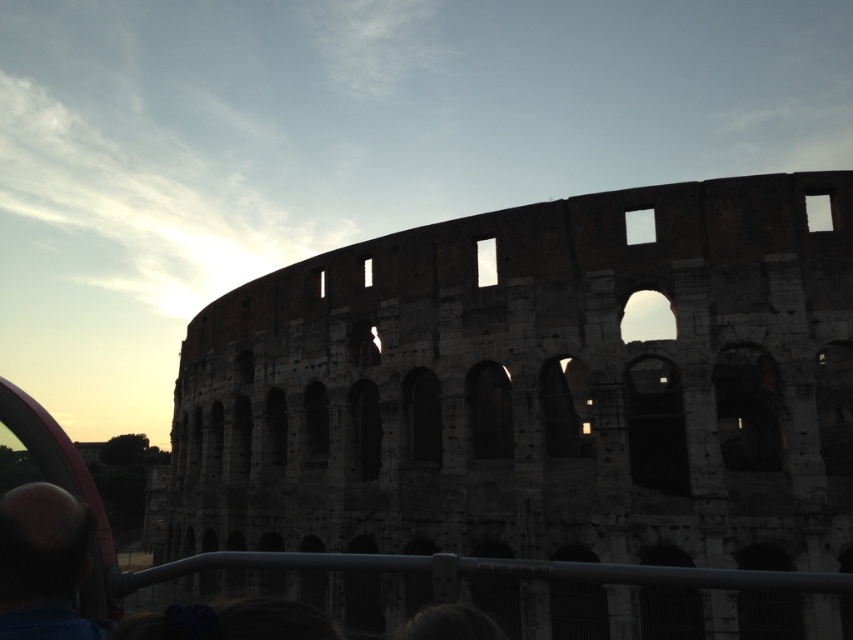
You are a tourist standing in front of the Colosseum and want to take a photo of the brown stone amphitheater at center without including the smooth bald head at lower left in the frame. Based on their positions, can you position yourself in a way to achieve this?

The brown stone amphitheater at center is located above the smooth bald head at lower left. To avoid including the smooth bald head at lower left in the photo, you can position yourself so that the camera is angled upwards, focusing on the higher position of the brown stone amphitheater at center while excluding the lower area where the smooth bald head at lower left is situated.

You are a photographer trying to capture the brown stone amphitheater at center and the smooth bald head at lower left in the same frame. Based on their positions, which object would appear larger in your photo?

The brown stone amphitheater at center would appear larger in the photo because it is closer to the camera than the smooth bald head at lower left.

You are standing at the point marked as point (538, 388) in the Colosseum image. What is the material of the surface you are currently standing on?

The point (538, 388) is on brown stone amphitheater at center, so the surface is made of brown stone.